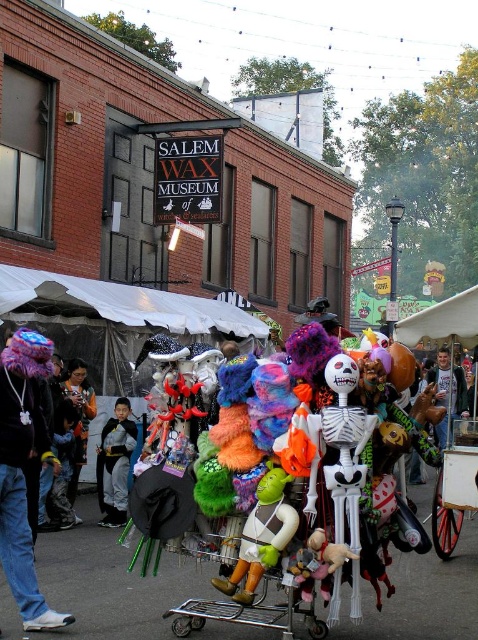
You are at the Salem Wax Museum festival and want to buy a souvenir. You see the fuzzy purple hat at left and the multicolored plush toy at center. Which item is positioned more to the right?

The fuzzy purple hat at left is positioned to the right of the multicolored plush toy at center, so the fuzzy purple hat at left is more to the right.